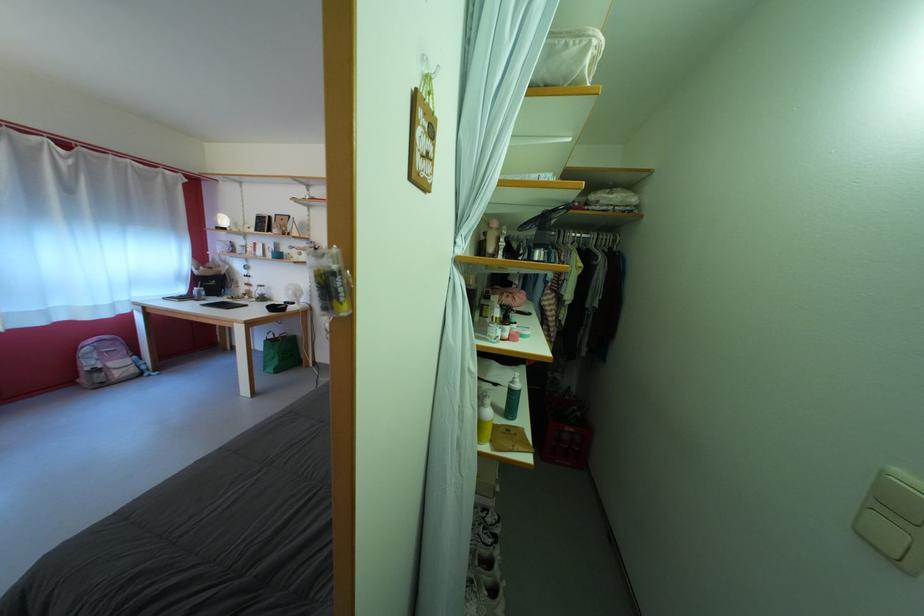
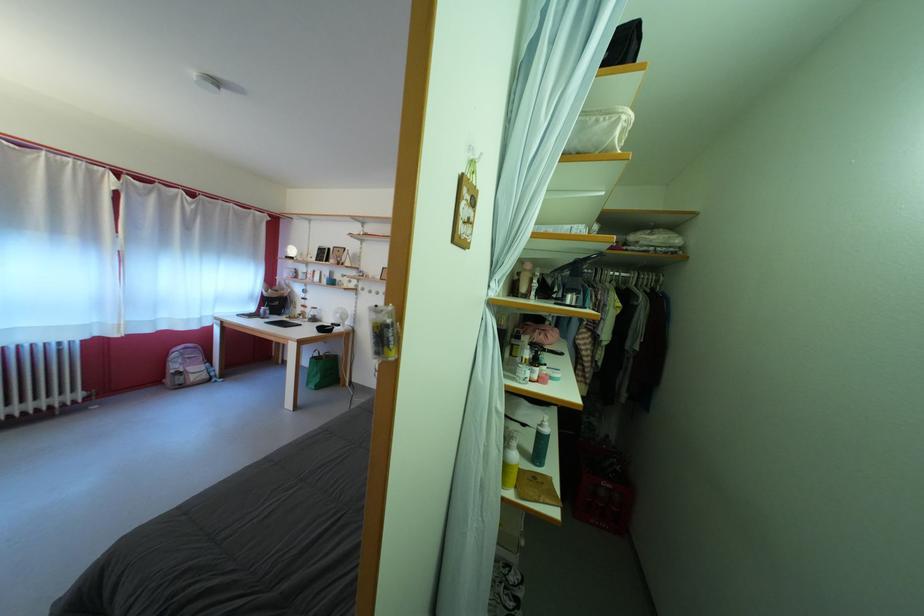
Find the pixel in the second image that matches (x=520, y=389) in the first image.

(549, 431)